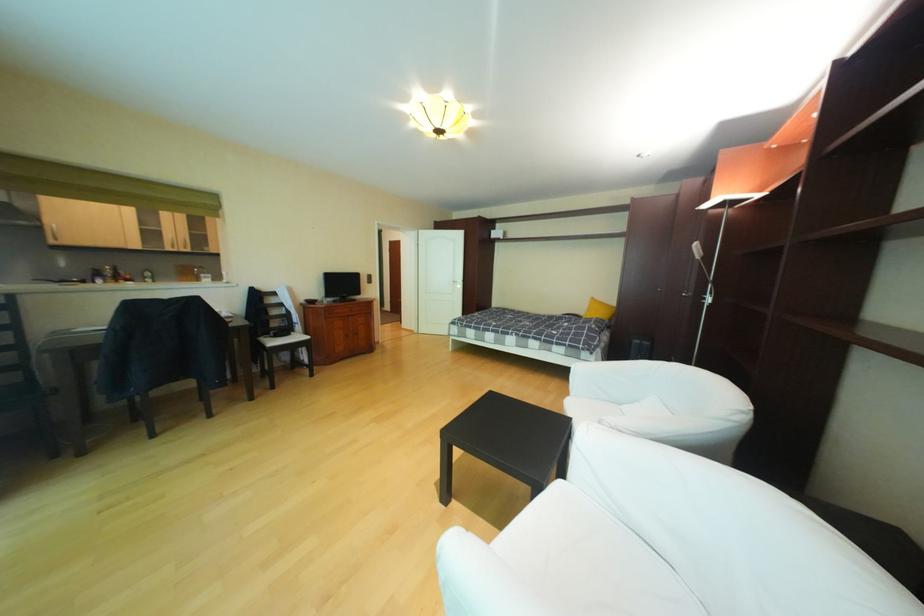
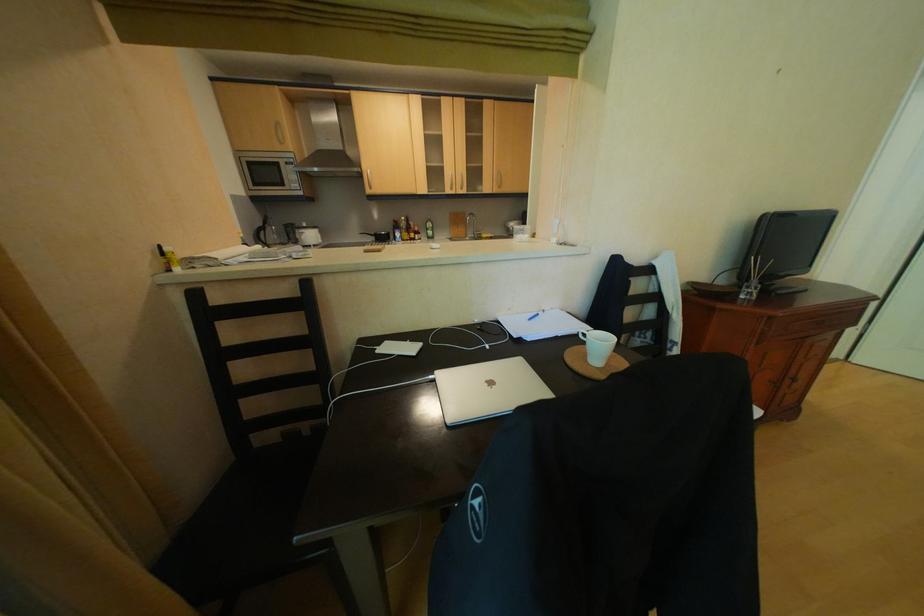
The point at (x=46, y=281) is marked in the first image. Where is the corresponding point in the second image?

(372, 235)